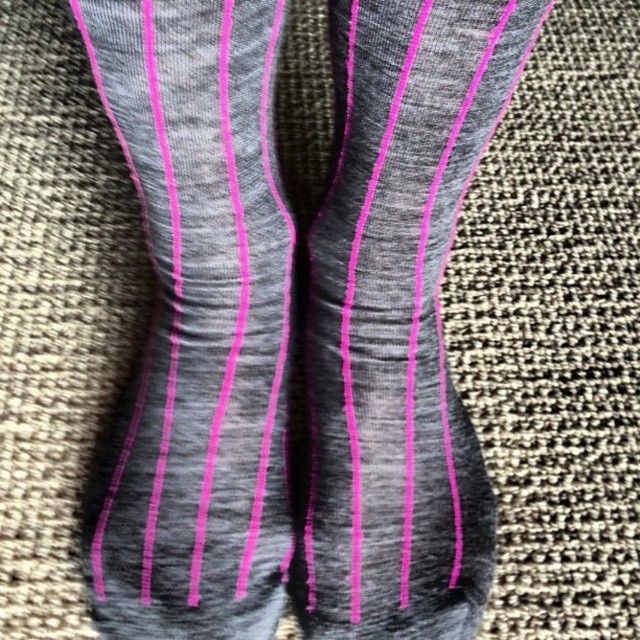
You are organizing a drawer and want to place the gray heathered sock at center and the matte gray sock at center side by side. Which sock will require more horizontal space?

The matte gray sock at center requires more horizontal space because its width is greater than the gray heathered sock at center.

You are a delivery robot with a 6 inch wide package. You need to place the package between the gray heathered sock at center and the matte gray sock at center. Can you fit the package between them?

The gray heathered sock at center is 5.09 inches away from matte gray sock at center. Since the package is 6 inches wide, it cannot fit between them as the distance is less than the package width.